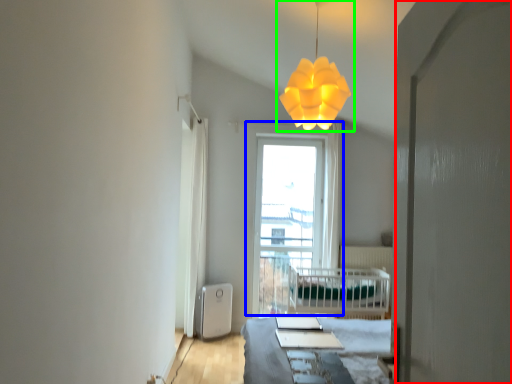
Question: Based on their relative distances, which object is nearer to screen door (highlighted by a red box)? Choose from window (highlighted by a blue box) and lamp (highlighted by a green box).

Choices:
 (A) window
 (B) lamp

Answer: (B)